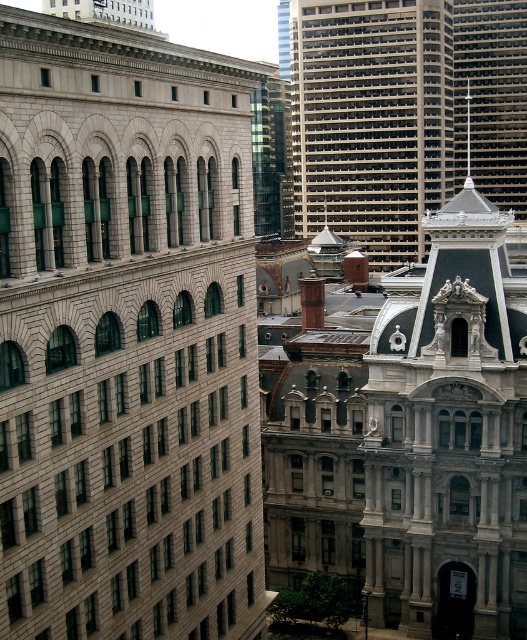
Does gray concrete skyscraper at upper center have a smaller size compared to smooth gray spire at upper right?

No.

Is gray concrete skyscraper at upper center further to the viewer compared to smooth gray spire at upper right?

No, it is not.

Who is more forward, (315,198) or (466,129)?

Positioned in front is point (315,198).

You are a GUI agent. You are given a task and a screenshot of the screen. Output one action in this format:
    pyautogui.click(x=<x>, y=<y>)
    Task: Click on the gray concrete skyscraper at upper center
    
    Given the screenshot: What is the action you would take?
    pyautogui.click(x=404, y=113)

From the picture: Who is more distant from viewer, (x=118, y=77) or (x=356, y=202)?

The point (x=356, y=202) is behind.

Describe the element at coordinates (126, 337) in the screenshot. I see `gray stone building at left` at that location.

Who is more distant from viewer, (209, 154) or (424, 150)?

The point (424, 150) is behind.

You are a GUI agent. You are given a task and a screenshot of the screen. Output one action in this format:
    pyautogui.click(x=<x>, y=<y>)
    Task: Click on the gray stone building at left
    
    Given the screenshot: What is the action you would take?
    pyautogui.click(x=126, y=337)

Based on the photo, is gray stone building at left in front of smooth gray spire at upper right?

Yes, it is in front of smooth gray spire at upper right.

Based on the photo, is gray stone building at left positioned at the back of smooth gray spire at upper right?

No, it is in front of smooth gray spire at upper right.

This screenshot has width=527, height=640. What do you see at coordinates (126, 337) in the screenshot?
I see `gray stone building at left` at bounding box center [126, 337].

Find the location of a particular element. The height and width of the screenshot is (640, 527). gray stone building at left is located at coordinates (126, 337).